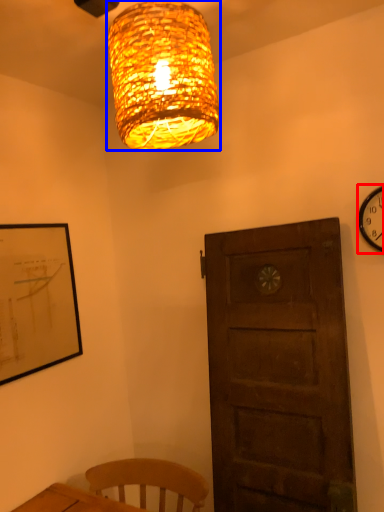
Question: Which object is further to the camera taking this photo, wall clock (highlighted by a red box) or lamp (highlighted by a blue box)?

Choices:
 (A) wall clock
 (B) lamp

Answer: (A)